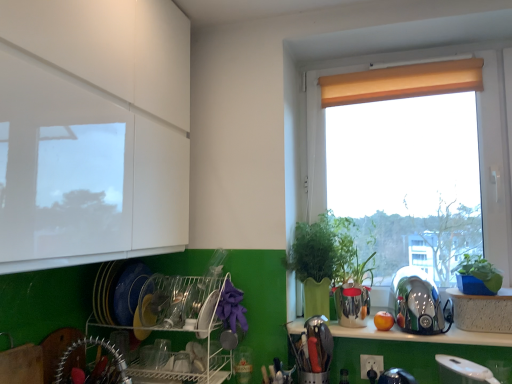
In order to click on green matte plant at right in this screenshot , I will do `click(323, 250)`.

The image size is (512, 384). What do you see at coordinates (482, 311) in the screenshot?
I see `white textured cabinet at lower right` at bounding box center [482, 311].

Image resolution: width=512 pixels, height=384 pixels. What do you see at coordinates (422, 335) in the screenshot? I see `white glossy countertop at lower right` at bounding box center [422, 335].

What is the approximate width of brushed metal utensil rack at lower left, positioned as the first appliance in left-to-right order?

The width of brushed metal utensil rack at lower left, positioned as the first appliance in left-to-right order, is 7.66 inches.

What do you see at coordinates (95, 344) in the screenshot? I see `brushed metal utensil rack at lower left, which is counted as the fourth appliance, starting from the right` at bounding box center [95, 344].

Identify the location of matte beige roller shade at upper right. The height and width of the screenshot is (384, 512). (495, 154).

From the image's perspective, between green matte plant at right and brushed metal utensil rack at lower left, which is counted as the fourth appliance, starting from the right, which one is located above?

green matte plant at right.

Is green matte plant at right not within brushed metal utensil rack at lower left, which is counted as the fourth appliance, starting from the right?

Yes, green matte plant at right is located beyond the bounds of brushed metal utensil rack at lower left, which is counted as the fourth appliance, starting from the right.

Is green matte plant at right taller or shorter than brushed metal utensil rack at lower left, which is counted as the fourth appliance, starting from the right?

In the image, green matte plant at right appears to be taller than brushed metal utensil rack at lower left, which is counted as the fourth appliance, starting from the right.

From a real-world perspective, is green matte plant at right physically located above or below brushed metal utensil rack at lower left, positioned as the first appliance in left-to-right order?

Clearly, from a real-world perspective, green matte plant at right is above brushed metal utensil rack at lower left, positioned as the first appliance in left-to-right order.

Looking at the image, does white glossy kettle at lower right, the 4th appliance when ordered from left to right, seem bigger or smaller compared to beige fabric curtain at upper right?

white glossy kettle at lower right, the 4th appliance when ordered from left to right, is smaller than beige fabric curtain at upper right.

Based on the photo, is there a large distance between white glossy kettle at lower right, the 4th appliance when ordered from left to right, and beige fabric curtain at upper right?

Indeed, white glossy kettle at lower right, the 4th appliance when ordered from left to right, is not near beige fabric curtain at upper right.

Is the position of white glossy kettle at lower right, the 4th appliance when ordered from left to right, more distant than that of beige fabric curtain at upper right?

No, white glossy kettle at lower right, the 4th appliance when ordered from left to right, is closer to the camera.

From a real-world perspective, is white glossy kettle at lower right, the 4th appliance when ordered from left to right, physically above beige fabric curtain at upper right?

Actually, white glossy kettle at lower right, the 4th appliance when ordered from left to right, is physically below beige fabric curtain at upper right in the real world.

Which object is closer to the camera taking this photo, white glossy countertop at lower right or brushed metal utensil rack at lower left, which is counted as the fourth appliance, starting from the right?

brushed metal utensil rack at lower left, which is counted as the fourth appliance, starting from the right, is more forward.

Is white glossy countertop at lower right far from brushed metal utensil rack at lower left, which is counted as the fourth appliance, starting from the right?

No, white glossy countertop at lower right is not far away from brushed metal utensil rack at lower left, which is counted as the fourth appliance, starting from the right.

Does white glossy countertop at lower right have a larger size compared to brushed metal utensil rack at lower left, which is counted as the fourth appliance, starting from the right?

No.

In order to click on counter top that is above the brushed metal utensil rack at lower left, which is counted as the fourth appliance, starting from the right (from the image's perspective) in this screenshot , I will do `click(422, 335)`.

Which of these two, beige fabric curtain at upper right or white plastic dish rack at lower left, is bigger?

Bigger between the two is white plastic dish rack at lower left.

From a real-world perspective, is beige fabric curtain at upper right over white plastic dish rack at lower left?

Indeed, from a real-world perspective, beige fabric curtain at upper right stands above white plastic dish rack at lower left.

Does beige fabric curtain at upper right have a greater height compared to white plastic dish rack at lower left?

In fact, beige fabric curtain at upper right may be shorter than white plastic dish rack at lower left.

Is there a large distance between beige fabric curtain at upper right and white plastic dish rack at lower left?

Indeed, beige fabric curtain at upper right is not near white plastic dish rack at lower left.

Considering the relative sizes of white glossy kettle at lower right, the 4th appliance when ordered from left to right, and white plastic dish rack at lower left in the image provided, is white glossy kettle at lower right, the 4th appliance when ordered from left to right, bigger than white plastic dish rack at lower left?

→ No, white glossy kettle at lower right, the 4th appliance when ordered from left to right, is not bigger than white plastic dish rack at lower left.

Considering the relative sizes of white glossy kettle at lower right, placed as the first appliance when sorted from right to left, and white plastic dish rack at lower left in the image provided, is white glossy kettle at lower right, placed as the first appliance when sorted from right to left, shorter than white plastic dish rack at lower left?

Correct, white glossy kettle at lower right, placed as the first appliance when sorted from right to left, is not as tall as white plastic dish rack at lower left.

Between green matte plant at right and white plastic dish rack at lower left, which one has more height?

Standing taller between the two is green matte plant at right.

Does green matte plant at right have a greater width compared to white plastic dish rack at lower left?

No.

From the image's perspective, is green matte plant at right located beneath white plastic dish rack at lower left?

No, from the image's perspective, green matte plant at right is not beneath white plastic dish rack at lower left.

Is white plastic dish rack at lower left completely or partially inside green matte plant at right?

No, white plastic dish rack at lower left is located outside of green matte plant at right.

Locate an element on the screen. shelf below the green plastic pot at right (from the image's perspective) is located at coordinates (x=183, y=326).

From the image's perspective, which one is positioned lower, green plastic pot at right or white plastic dish rack at lower left?

white plastic dish rack at lower left, from the image's perspective.

Is green plastic pot at right thinner than white plastic dish rack at lower left?

Yes.

In terms of size, does green plastic pot at right appear bigger or smaller than white plastic dish rack at lower left?

In the image, green plastic pot at right appears to be smaller than white plastic dish rack at lower left.

There is a green matte plant at right. Identify the location of the 3rd appliance below it (from a real-world perspective). (95, 344).

Where is `curtain behind the white glossy kettle at lower right, placed as the first appliance when sorted from right to left`? This screenshot has height=384, width=512. curtain behind the white glossy kettle at lower right, placed as the first appliance when sorted from right to left is located at coordinates (402, 82).

Considering their positions, is white plastic dish rack at lower left positioned further to green matte plant at right than white glossy countertop at lower right?

white plastic dish rack at lower left lies further to green matte plant at right than the other object.

Based on their spatial positions, is metallic silver utensil holder at lower center, acting as the 2th appliance starting from the left, or white textured cabinet at lower right closer to polished metallic kettle at right, marked as the third appliance in a left-to-right arrangement?

white textured cabinet at lower right lies closer to polished metallic kettle at right, marked as the third appliance in a left-to-right arrangement, than the other object.

From the picture: Considering their positions, is polished metallic kettle at right, which ranks as the second appliance in right-to-left order, positioned closer to beige fabric curtain at upper right than metallic silver utensil holder at lower center, acting as the third appliance starting from the right?

polished metallic kettle at right, which ranks as the second appliance in right-to-left order.

Estimate the real-world distances between objects in this image. Which object is closer to matte beige roller shade at upper right, white glossy kettle at lower right, placed as the first appliance when sorted from right to left, or metallic silver utensil holder at lower center, acting as the third appliance starting from the right?

white glossy kettle at lower right, placed as the first appliance when sorted from right to left, is positioned closer to the anchor matte beige roller shade at upper right.

Estimate the real-world distances between objects in this image. Which object is further from white glossy countertop at lower right, brushed metal utensil rack at lower left, positioned as the first appliance in left-to-right order, or white textured cabinet at lower right?

The object further to white glossy countertop at lower right is brushed metal utensil rack at lower left, positioned as the first appliance in left-to-right order.

In the scene shown: Considering their positions, is white glossy countertop at lower right positioned closer to white plastic dish rack at lower left than brushed metal utensil rack at lower left, positioned as the first appliance in left-to-right order?

Based on the image, brushed metal utensil rack at lower left, positioned as the first appliance in left-to-right order, appears to be nearer to white plastic dish rack at lower left.

In the scene shown: Looking at the image, which one is located further to brushed metal utensil rack at lower left, which is counted as the fourth appliance, starting from the right, white plastic dish rack at lower left or beige fabric curtain at upper right?

beige fabric curtain at upper right is further to brushed metal utensil rack at lower left, which is counted as the fourth appliance, starting from the right.

Considering their positions, is white textured cabinet at lower right positioned further to polished metallic kettle at right, marked as the third appliance in a left-to-right arrangement, than green matte plant at right?

green matte plant at right is positioned further to the anchor polished metallic kettle at right, marked as the third appliance in a left-to-right arrangement.

Image resolution: width=512 pixels, height=384 pixels. What are the coordinates of `counter top situated between green matte plant at right and green plastic pot at right from left to right` in the screenshot? It's located at (422, 335).

You are a GUI agent. You are given a task and a screenshot of the screen. Output one action in this format:
    pyautogui.click(x=<x>, y=<y>)
    Task: Click on the window between green matte plant at right and green plastic pot at right in the horizontal direction
    The image size is (512, 384).
    Given the screenshot: What is the action you would take?
    pyautogui.click(x=495, y=154)

At what (x,y) coordinates should I click in order to perform the action: click on window between beige fabric curtain at upper right and polished metallic kettle at right, marked as the third appliance in a left-to-right arrangement, in the up-down direction. Please return your answer as a coordinate pair (x, y). This screenshot has height=384, width=512. Looking at the image, I should click on (495, 154).

Where is `counter top situated between green matte plant at right and polished metallic kettle at right, marked as the third appliance in a left-to-right arrangement, from left to right`? The image size is (512, 384). counter top situated between green matte plant at right and polished metallic kettle at right, marked as the third appliance in a left-to-right arrangement, from left to right is located at coordinates (422, 335).